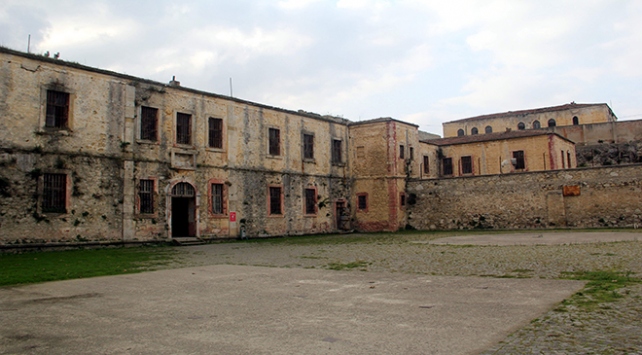
Find the location of a particular element. wall is located at coordinates (549, 197).